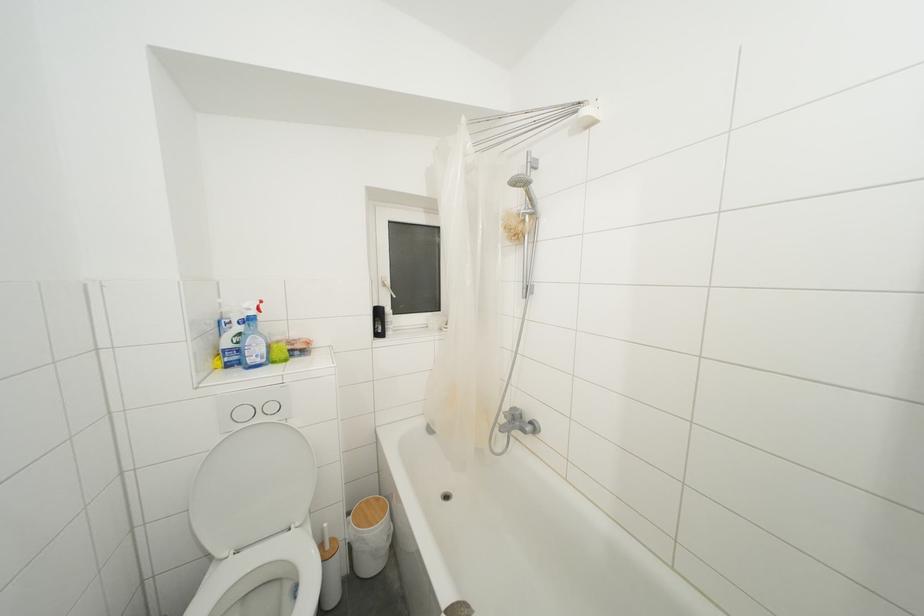
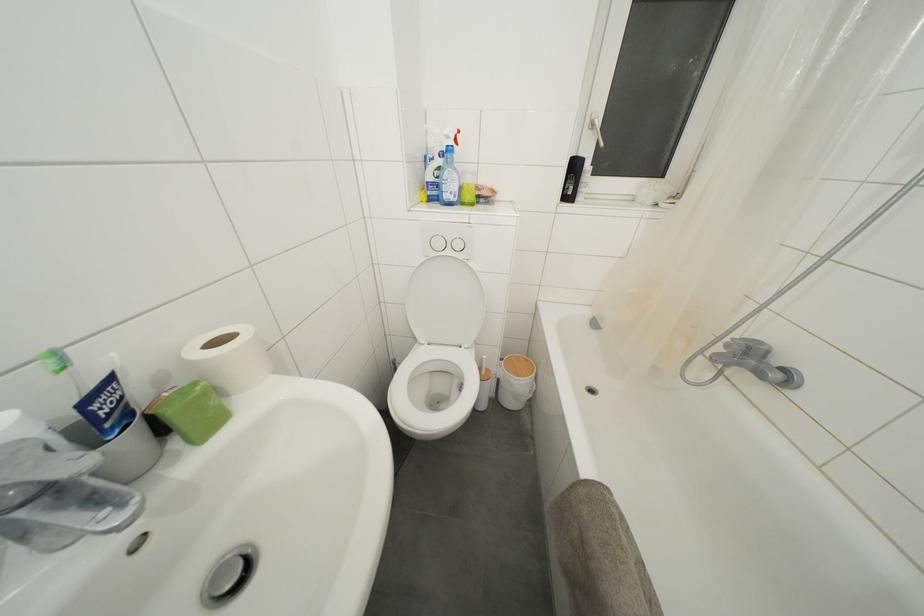
Where in the second image is the point corresponding to point 249,418 from the first image?

(443, 249)